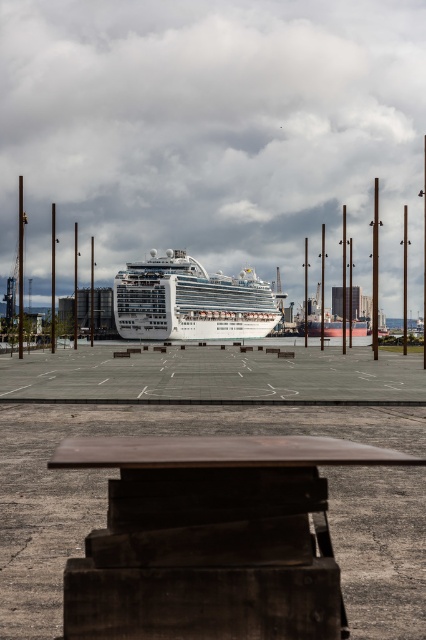
You are planning to take a photo of the white glossy cruise ship at center from the dark brown wooden picnic table at center. Will the picnic table block your view of the cruise ship?

The dark brown wooden picnic table at center is shorter than the white glossy cruise ship at center, so the picnic table will not block your view of the cruise ship.

You are standing on the wooden bench at the bottom of the image. Looking up, you see the dark brown wooden picnic table at center and the white glossy cruise ship at center. Which object is closer to your eyes?

The dark brown wooden picnic table at center is closer to your eyes because it is positioned below the white glossy cruise ship at center, meaning it is nearer to the observer standing on the wooden bench.

You are planning to host a picnic for a group of 10 people. You see the dark brown wooden picnic table at center and the white glossy cruise ship at center. Which object can accommodate all of you comfortably?

The white glossy cruise ship at center is larger than the dark brown wooden picnic table at center, so it can accommodate all 10 people comfortably.